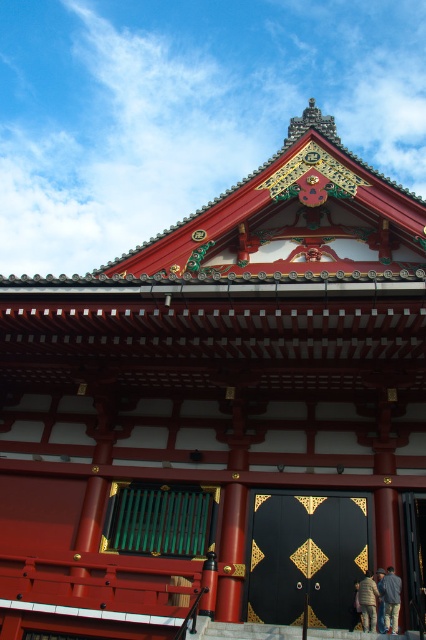
Question: Which object is farther from the camera taking this photo?

Choices:
 (A) denim jacket at lower right
 (B) black polished wood door at center

Answer: (B)

Question: Among these points, which one is farthest from the camera?

Choices:
 (A) (363, 620)
 (B) (385, 609)

Answer: (B)

Question: Does black polished wood door at center appear over light brown leather jacket at lower right?

Choices:
 (A) yes
 (B) no

Answer: (A)

Question: Is black polished wood door at center behind light brown leather jacket at lower right?

Choices:
 (A) no
 (B) yes

Answer: (B)

Question: Can you confirm if denim jacket at lower right is bigger than light brown leather jacket at lower right?

Choices:
 (A) no
 (B) yes

Answer: (B)

Question: Estimate the real-world distances between objects in this image. Which object is closer to the black polished wood door at center?

Choices:
 (A) light brown leather jacket at lower right
 (B) denim jacket at lower right

Answer: (A)